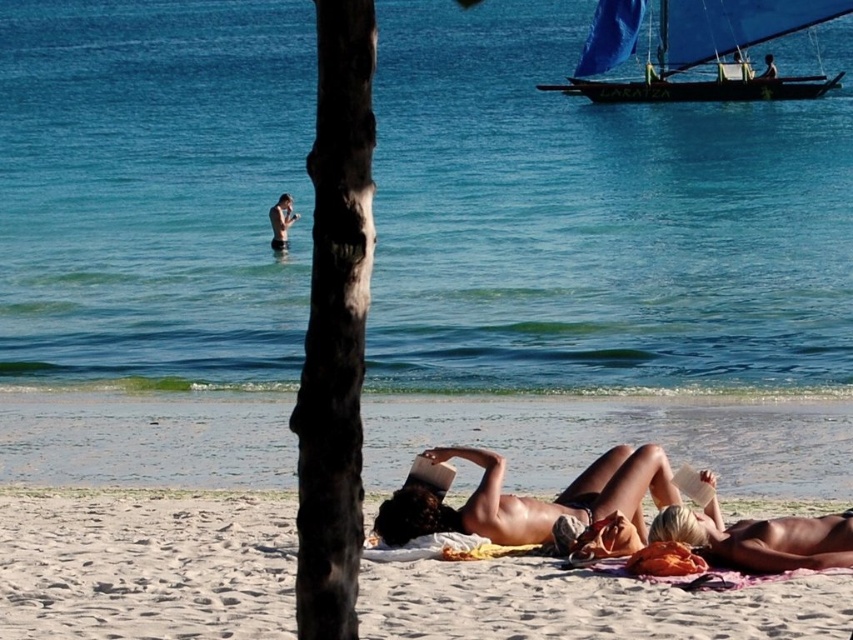
Question: Is the position of white sandy beach at lower center less distant than that of smooth skin torso at center?

Choices:
 (A) no
 (B) yes

Answer: (B)

Question: Which of these objects is positioned closest to the white sandy beach at lower center?

Choices:
 (A) tan skin bikini at center
 (B) smooth skin person at center
 (C) blue sailboat at upper right

Answer: (A)

Question: Can you confirm if blue sailboat at upper right is bigger than tan skin bikini at center?

Choices:
 (A) no
 (B) yes

Answer: (A)

Question: Which point appears closest to the camera in this image?

Choices:
 (A) (67, 570)
 (B) (596, 10)
 (C) (396, 509)
 (D) (769, 65)

Answer: (A)

Question: Observing the image, what is the correct spatial positioning of blue water at center in reference to blue sailboat at upper right?

Choices:
 (A) left
 (B) right

Answer: (A)

Question: Which object is closer to the camera taking this photo?

Choices:
 (A) white sandy beach at lower center
 (B) smooth skin person at center
 (C) smooth skin torso at center
 (D) blue sailboat at upper right

Answer: (A)